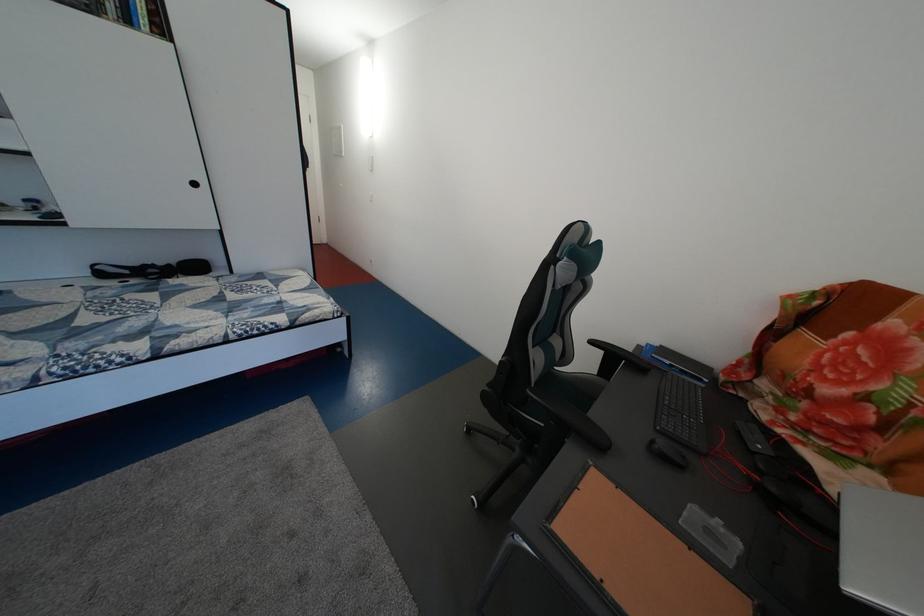
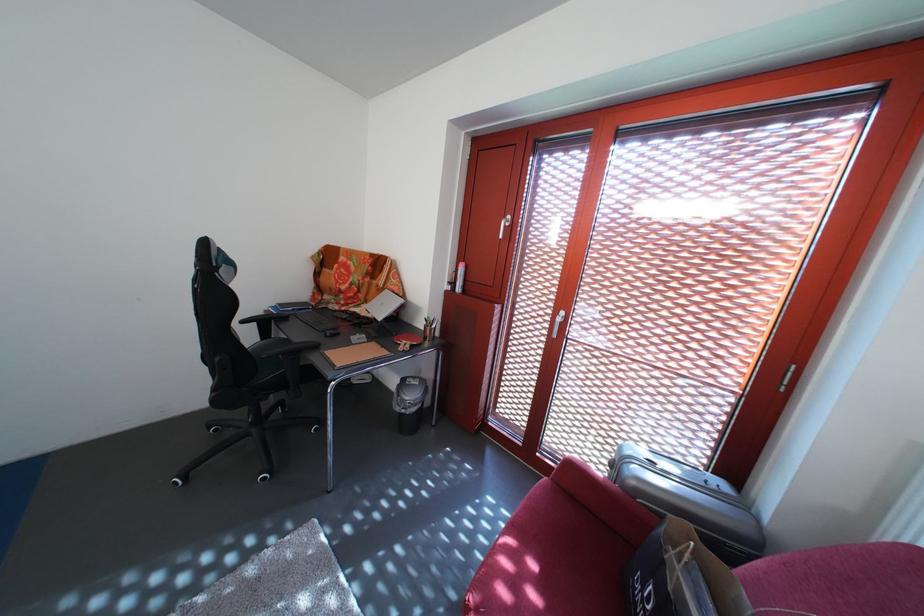
The first image is from the beginning of the video and the second image is from the end. How did the camera likely rotate when shooting the video?

The rotation direction of the camera is right-down.